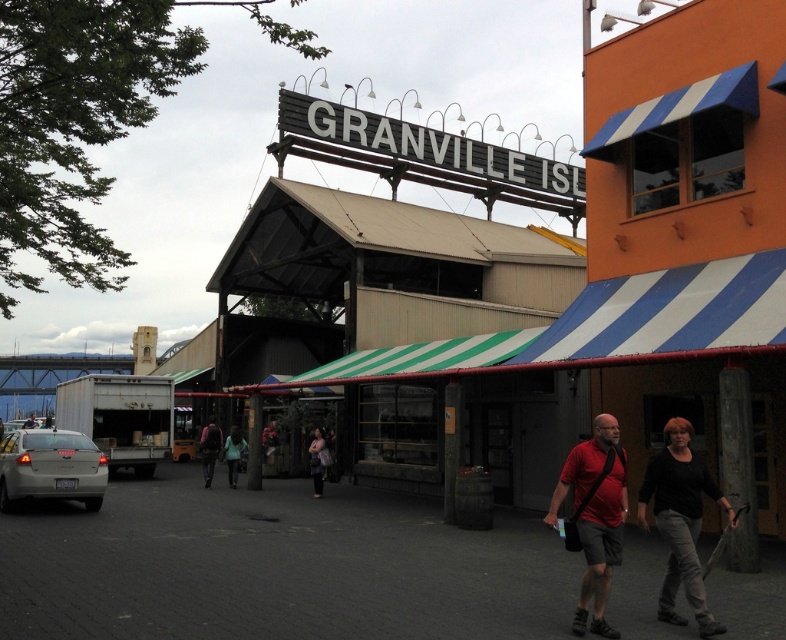
Based on the photo, measure the distance between black cotton shirt at center and matte black jacket at center.

They are 13.83 meters apart.

Does black cotton shirt at center lie behind matte black jacket at center?

That is False.

Does point (674, 593) come farther from viewer compared to point (314, 490)?

No.

The width and height of the screenshot is (786, 640). In order to click on black cotton shirt at center in this screenshot , I will do `click(680, 520)`.

Is point (605, 630) positioned behind point (226, 449)?

No, it is not.

Does point (597, 413) lie in front of point (230, 456)?

Yes, point (597, 413) is in front of point (230, 456).

Where is `matte red shirt at center`? matte red shirt at center is located at coordinates (594, 516).

Does black cotton shirt at center come behind light blue fabric jacket at center?

That is False.

Is black cotton shirt at center below light blue fabric jacket at center?

No, black cotton shirt at center is not below light blue fabric jacket at center.

Where is `black cotton shirt at center`? The image size is (786, 640). black cotton shirt at center is located at coordinates (680, 520).